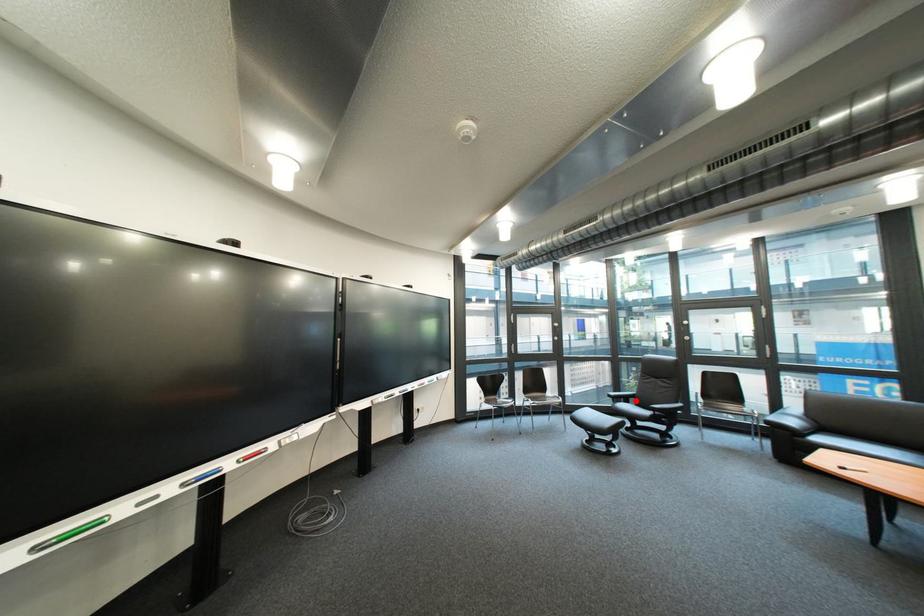
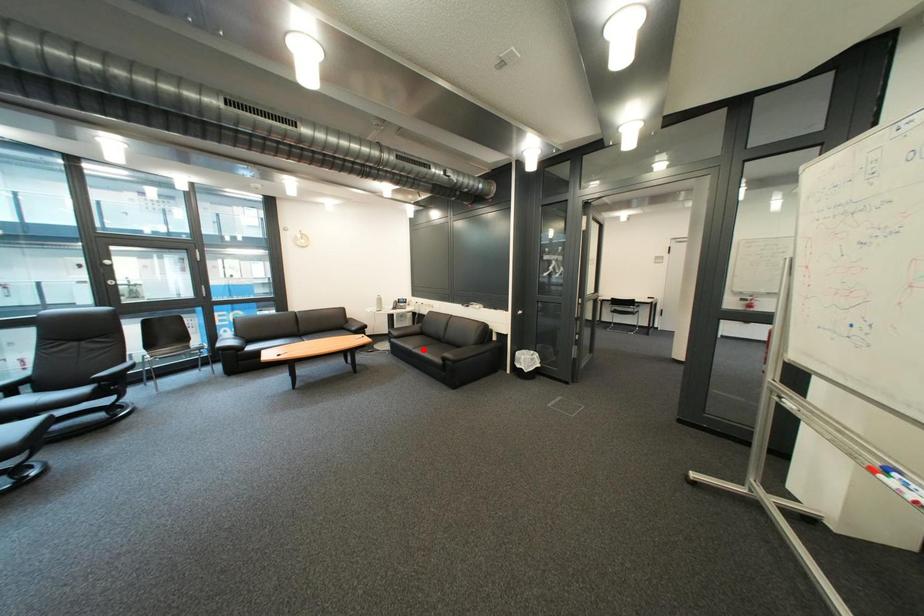
I am providing you with two images of the same scene from different viewpoints. A red point is marked on the first image and another point is marked on the second image. Are the points marked in image1 and image2 representing the same 3D position?

No